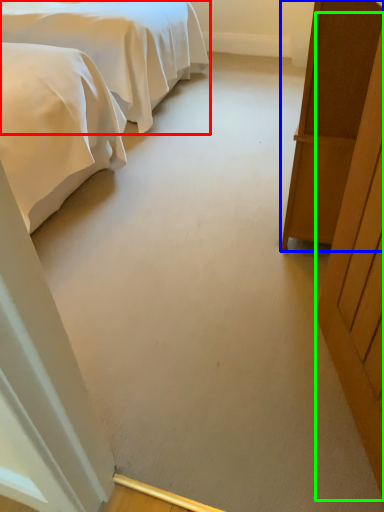
Question: Based on their relative distances, which object is farther from bed (highlighted by a red box)? Choose from furniture (highlighted by a blue box) and door (highlighted by a green box).

Choices:
 (A) furniture
 (B) door

Answer: (B)